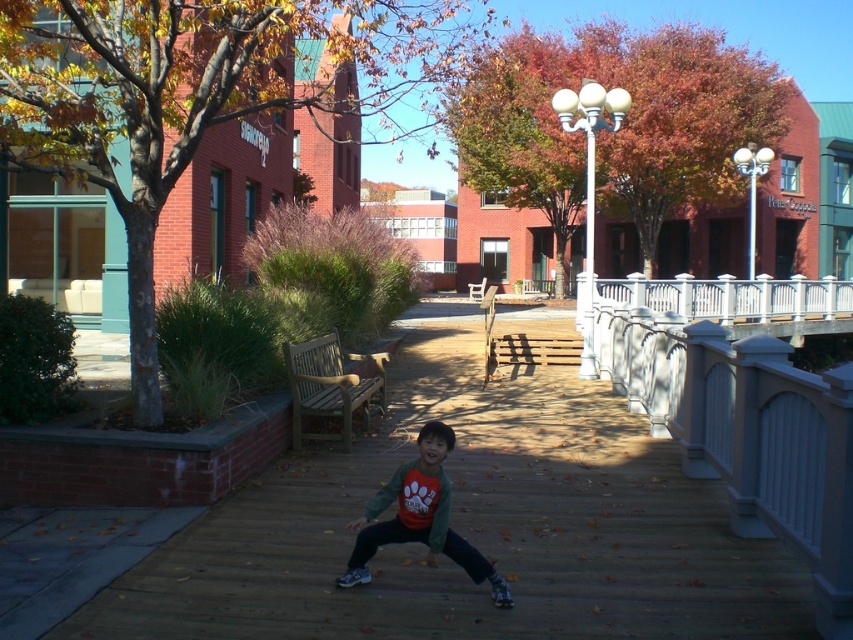
Question: Which of the following is the closest to the observer?

Choices:
 (A) wooden bench at center
 (B) matte green sweater at center

Answer: (B)

Question: Which is farther from the white painted wood railing at right?

Choices:
 (A) matte green sweater at center
 (B) wooden bench at center

Answer: (B)

Question: Is white painted wood railing at right positioned in front of wooden bench at center?

Choices:
 (A) no
 (B) yes

Answer: (B)

Question: Does matte green sweater at center appear over wooden bench at center?

Choices:
 (A) no
 (B) yes

Answer: (A)

Question: Which object is the farthest from the white painted wood railing at right?

Choices:
 (A) matte green sweater at center
 (B) wooden bench at center

Answer: (B)

Question: Can you confirm if white painted wood railing at right is bigger than wooden bench at center?

Choices:
 (A) yes
 (B) no

Answer: (A)